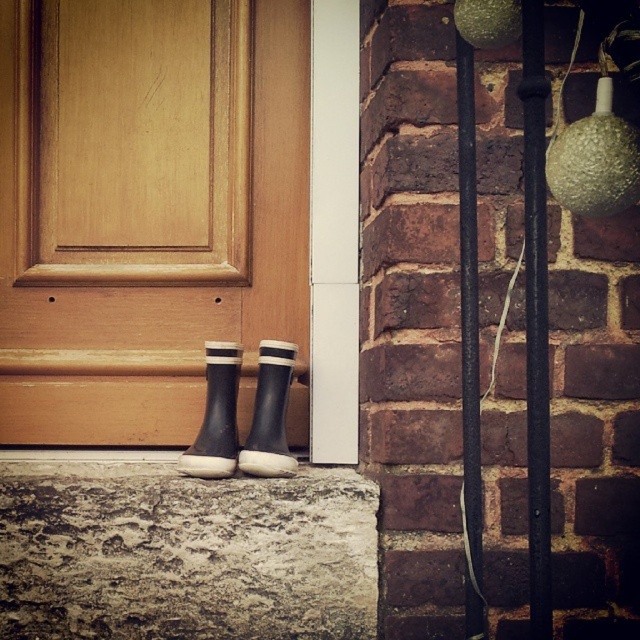
You are a delivery person trying to place a package on the step where the black rubber boot at lower center is located. However, the package is 1.2 meters in length. Can the package fit on the step without overlapping the matte wood door at lower center?

The matte wood door at lower center is larger in size than the black rubber boot at lower center. Since the package is 1.2 meters long, it might not fit on the step without overlapping the door, as the door is bigger and occupies more space.

You are a delivery person trying to place a package on the step where the black rubber boot at lower center is placed. However, the package is 10 cm tall. Can you safely place it there without blocking the matte wood door at lower center?

The matte wood door at lower center is located above the black rubber boot at lower center. Since the door is above the boot, placing a package 10 cm tall on the step where the boot is would not block the door as it is positioned higher up.

You are a painter who needs to know the relative sizes of the objects in the scene to plan your supplies. Given that the matte wood door at lower center and the rubber matte boot at center are both in your view, which object is taller?

The matte wood door at lower center is taller than the rubber matte boot at center according to the description.